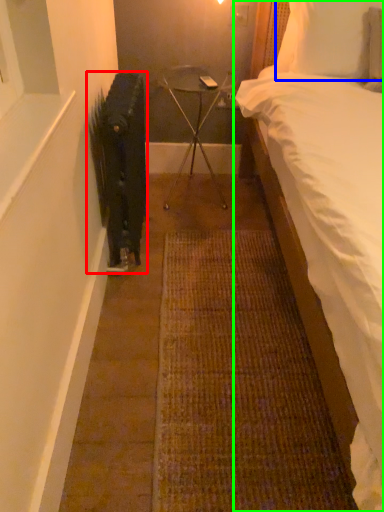
Question: Based on their relative distances, which object is nearer to radiator (highlighted by a red box)? Choose from pillow (highlighted by a blue box) and bed (highlighted by a green box).

Choices:
 (A) pillow
 (B) bed

Answer: (B)